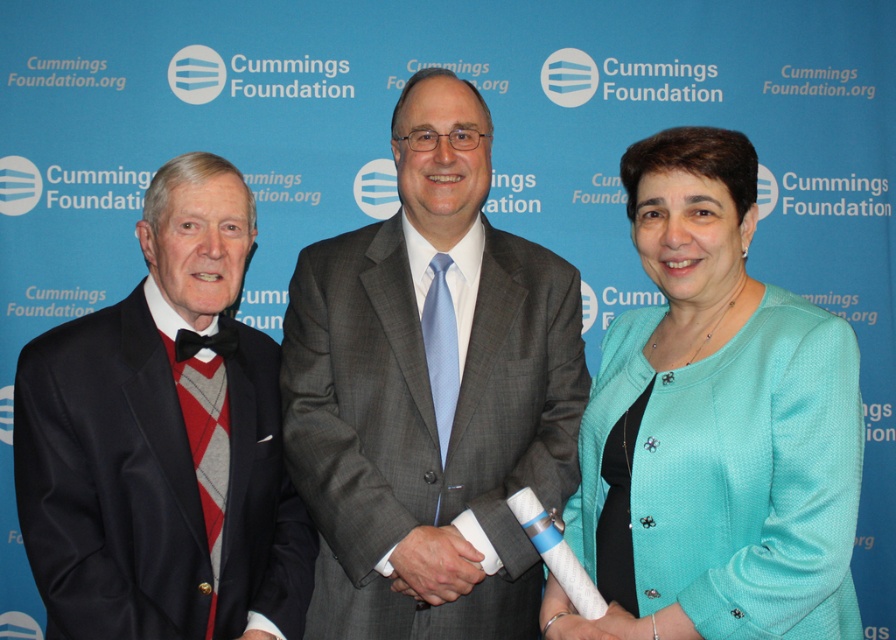
Does point (463, 310) lie in front of point (147, 492)?

No, (463, 310) is further to viewer.

Between point (418, 221) and point (197, 492), which one is positioned in front?

Positioned in front is point (197, 492).

Identify the location of gray textured suit at center. (429, 392).

Measure the distance between teal fabric jacket at center and camera.

teal fabric jacket at center and camera are 2.04 meters apart from each other.

This screenshot has height=640, width=896. What are the coordinates of `teal fabric jacket at center` in the screenshot? It's located at (714, 426).

Does gray textured suit at center have a greater width compared to teal fabric jacket at center?

Yes, gray textured suit at center is wider than teal fabric jacket at center.

Does gray textured suit at center have a lesser width compared to teal fabric jacket at center?

No, gray textured suit at center is not thinner than teal fabric jacket at center.

This screenshot has width=896, height=640. What do you see at coordinates (429, 392) in the screenshot? I see `gray textured suit at center` at bounding box center [429, 392].

The image size is (896, 640). I want to click on gray textured suit at center, so click(x=429, y=392).